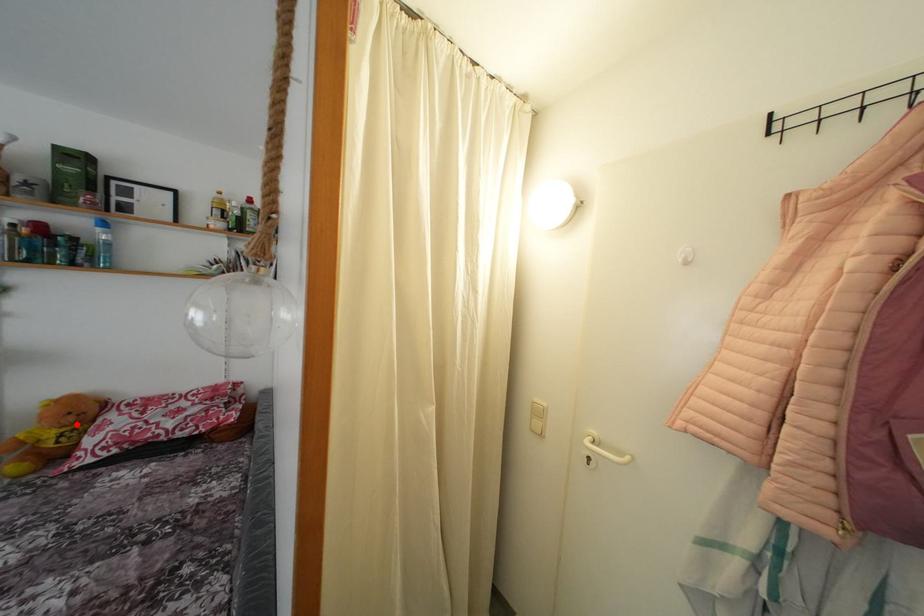
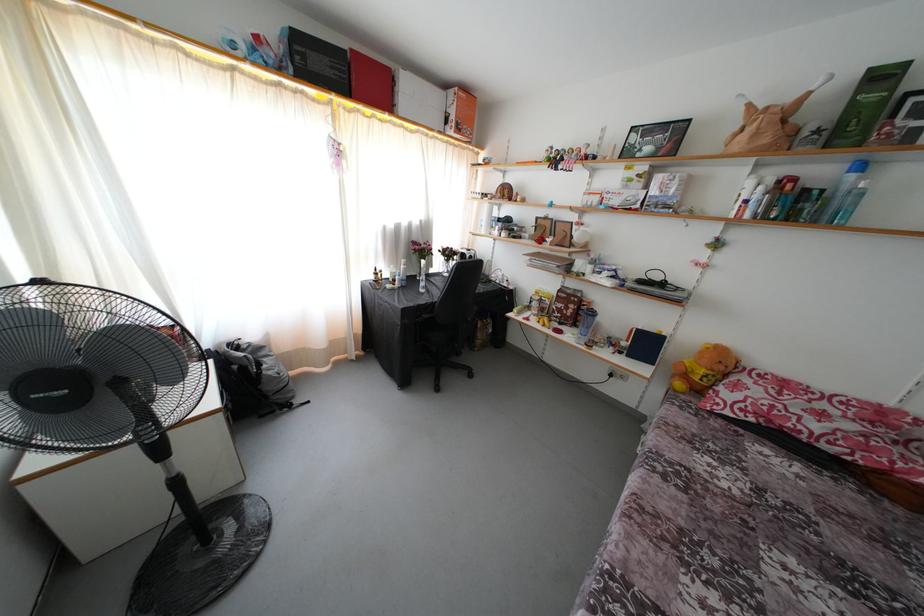
Find the pixel in the second image that matches the highlighted location in the first image.

(726, 373)